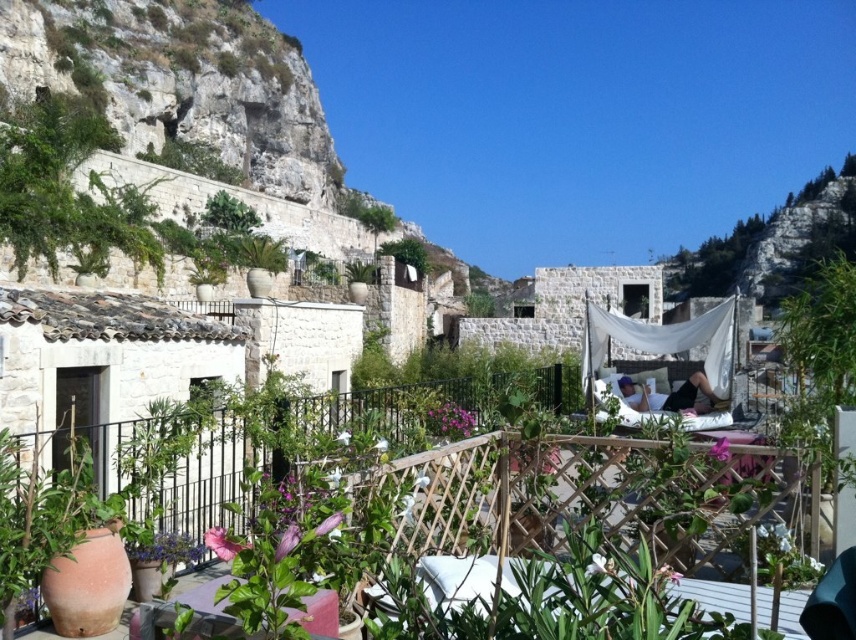
You are planning to place a new small statue in the village scene. The statue is exactly the same size as the green leafy plant at center. Will the statue fit in the space currently occupied by the green bamboo at right without overlapping?

The green bamboo at right is larger in size than the green leafy plant at center. Since the statue is the same size as the green leafy plant at center, it will fit in the space occupied by the green bamboo at right without overlapping because the bamboo has a larger area available.